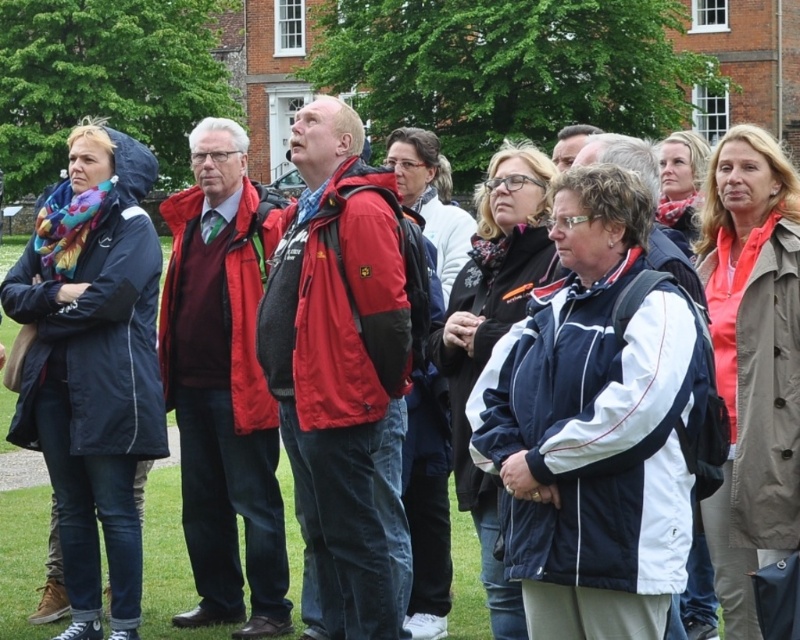
Question: Which point is closer to the camera taking this photo?

Choices:
 (A) (348, 449)
 (B) (662, 513)
 (C) (244, 211)
 (D) (20, 371)

Answer: (B)

Question: Is navy blue/white jacket at center below matte blue jacket at left?

Choices:
 (A) no
 (B) yes

Answer: (B)

Question: Which point appears farthest from the camera in this image?

Choices:
 (A) (574, 412)
 (B) (137, 216)
 (C) (346, 502)

Answer: (B)

Question: Does navy blue/white jacket at center have a smaller size compared to matte red jacket at center?

Choices:
 (A) no
 (B) yes

Answer: (B)

Question: Is matte blue jacket at left smaller than matte red sweater at center?

Choices:
 (A) yes
 (B) no

Answer: (B)

Question: Which is nearer to the matte red jacket at center?

Choices:
 (A) matte red sweater at center
 (B) matte blue jacket at left

Answer: (A)